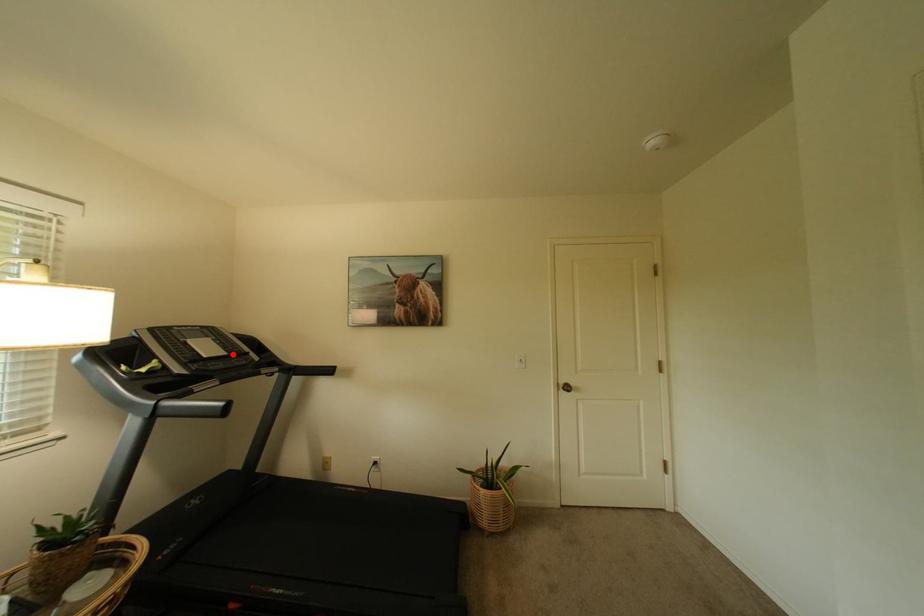
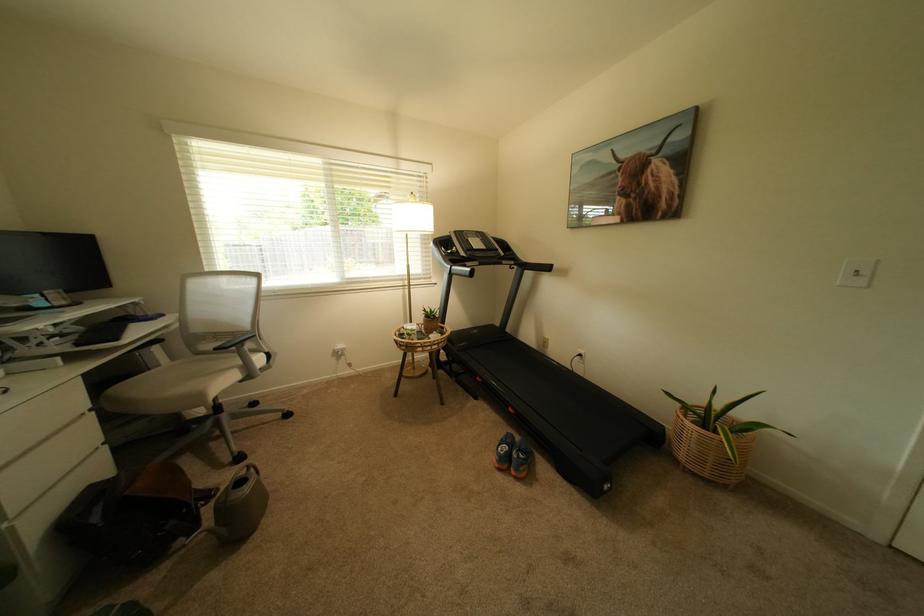
Question: I am providing you with two images of the same scene from different viewpoints. Image1 has a red point marked. In image2, the corresponding 3D location appears at what relative position? Reply with the corresponding letter.

Choices:
 (A) Closer
 (B) Farther

Answer: (A)